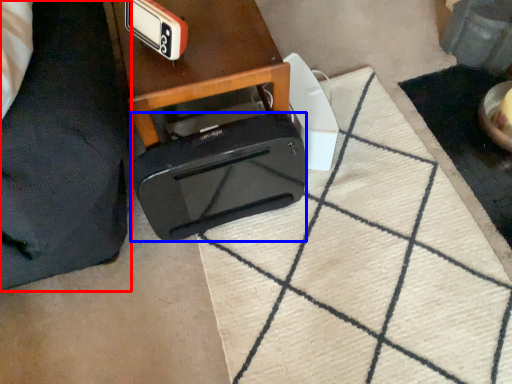
Question: Which object appears closest to the camera in this image, furniture (highlighted by a red box) or toaster (highlighted by a blue box)?

Choices:
 (A) furniture
 (B) toaster

Answer: (A)